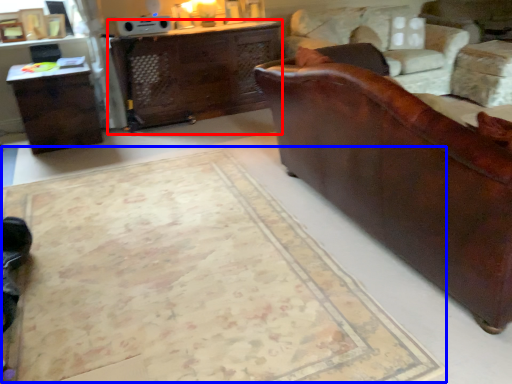
Question: Which point is closer to the camera, desk (highlighted by a red box) or mat (highlighted by a blue box)?

Choices:
 (A) desk
 (B) mat

Answer: (B)